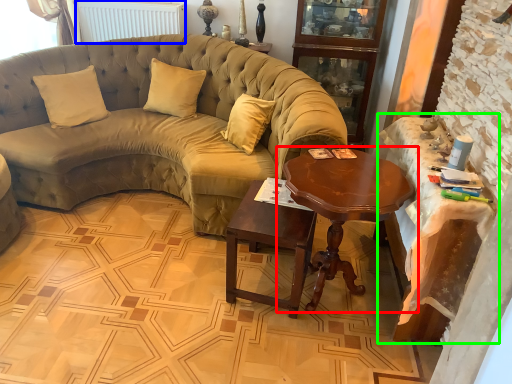
Question: Considering the real-world distances, which object is closest to coffee table (highlighted by a red box)? radiator (highlighted by a blue box) or table (highlighted by a green box).

Choices:
 (A) radiator
 (B) table

Answer: (B)